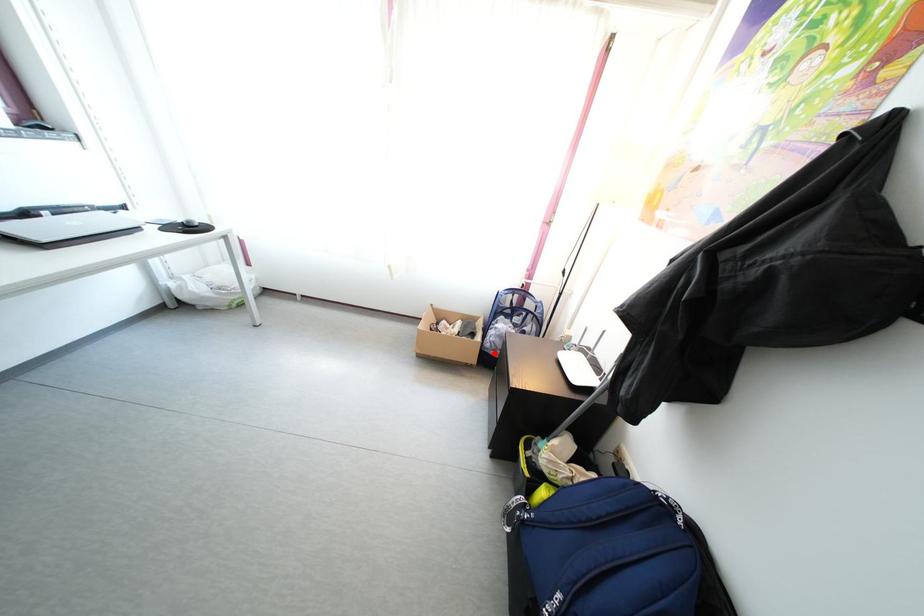
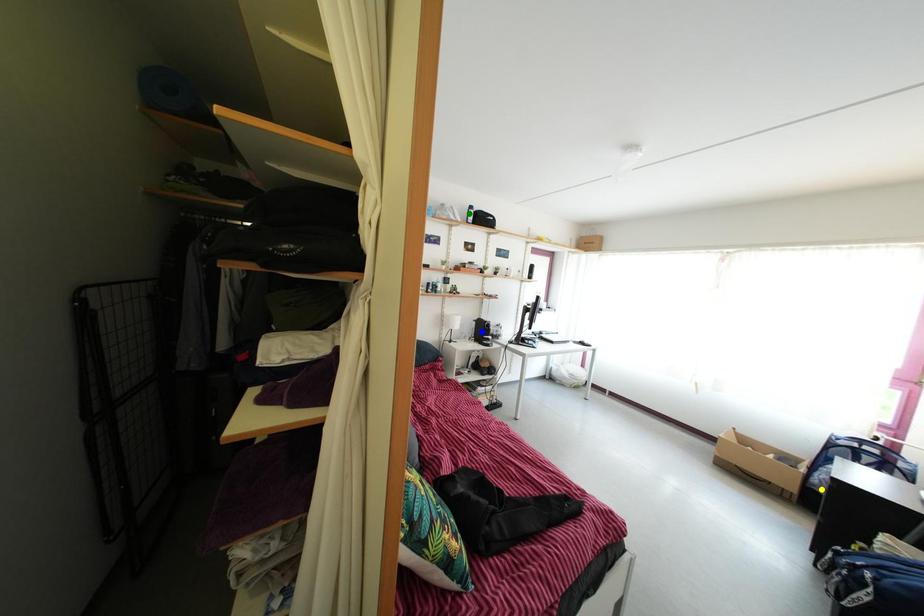
Question: I am providing you with two images of the same scene from different viewpoints. A red point is marked on the first image. You are given multiple points on the second image. Can you choose the point in image 2 that corresponds to the point in image 1?

Choices:
 (A) green point
 (B) blue point
 (C) yellow point

Answer: (C)